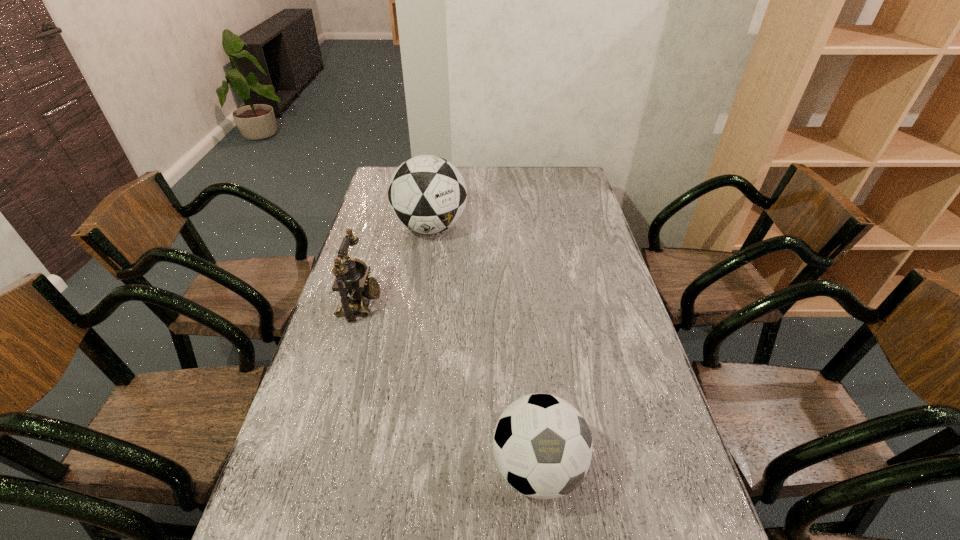
This screenshot has height=540, width=960. Identify the location of the taller soccer ball. (427, 194).

The height and width of the screenshot is (540, 960). What are the coordinates of `the left soccer ball` in the screenshot? It's located at (427, 194).

Find the location of a particular element. The width and height of the screenshot is (960, 540). telephone is located at coordinates (351, 280).

The height and width of the screenshot is (540, 960). In order to click on the nearer soccer ball in this screenshot , I will do `click(542, 445)`.

You are a GUI agent. You are given a task and a screenshot of the screen. Output one action in this format:
    pyautogui.click(x=<x>, y=<y>)
    Task: Click on the nearest object
    The image size is (960, 540).
    Given the screenshot: What is the action you would take?
    pyautogui.click(x=542, y=445)

The height and width of the screenshot is (540, 960). I want to click on vacant point located 0.290m on the surface of the left soccer ball where the brand logo is visible, so click(419, 306).

Locate an element on the screen. Image resolution: width=960 pixels, height=540 pixels. free space located 0.330m on the rotary dial of the telephone is located at coordinates (486, 304).

Image resolution: width=960 pixels, height=540 pixels. Identify the location of soccer ball located at the left edge. (427, 194).

Locate an element on the screen. This screenshot has width=960, height=540. telephone situated at the left edge is located at coordinates (351, 280).

In the image, there is a desktop. Identify the location of free space at the left edge. (347, 367).